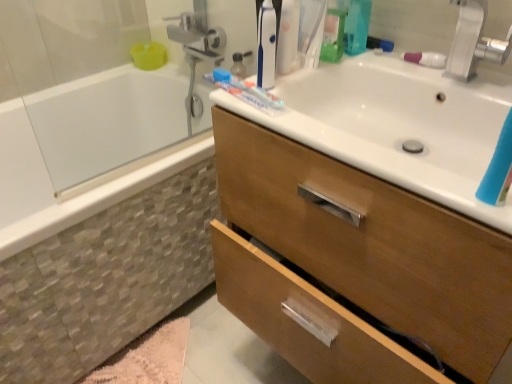
At what (x,y) coordinates should I click in order to perform the action: click on vacant space behind silver metallic faucet at upper right. Please return your answer as a coordinate pair (x, y). Looking at the image, I should click on (407, 64).